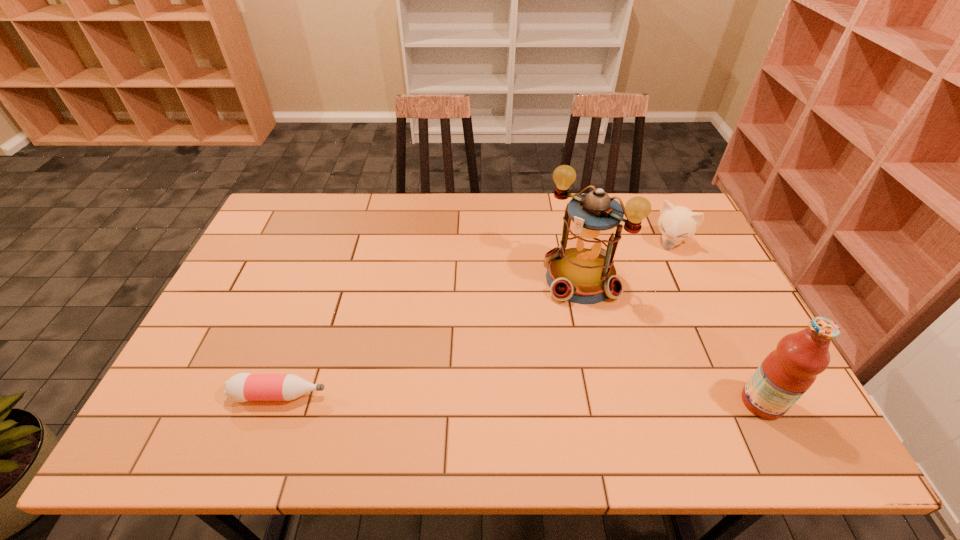
This screenshot has height=540, width=960. Find the location of `vacant space located 0.140m on the face of the second shortest object`. vacant space located 0.140m on the face of the second shortest object is located at coordinates (647, 278).

The width and height of the screenshot is (960, 540). Identify the location of free region located 0.390m on the face of the second shortest object. (612, 331).

Identify the location of vacant space situated on the face of the second shortest object. (630, 303).

The width and height of the screenshot is (960, 540). In order to click on object located at the far edge in this screenshot , I will do `click(677, 223)`.

The image size is (960, 540). I want to click on bottle situated at the near edge, so click(242, 387).

Where is `fruit juice that is at the near edge`? This screenshot has height=540, width=960. fruit juice that is at the near edge is located at coordinates (787, 372).

This screenshot has width=960, height=540. I want to click on object that is at the left edge, so click(x=242, y=387).

You are a GUI agent. You are given a task and a screenshot of the screen. Output one action in this format:
    pyautogui.click(x=<x>, y=<y>)
    Task: Click on the fruit juice located at the right edge
    Image resolution: width=960 pixels, height=540 pixels.
    Given the screenshot: What is the action you would take?
    pyautogui.click(x=787, y=372)

Identify the location of kitten that is at the right edge. The height and width of the screenshot is (540, 960). (677, 223).

At what (x,y) coordinates should I click in order to perform the action: click on object at the near left corner. Please return your answer as a coordinate pair (x, y). This screenshot has width=960, height=540. Looking at the image, I should click on (242, 387).